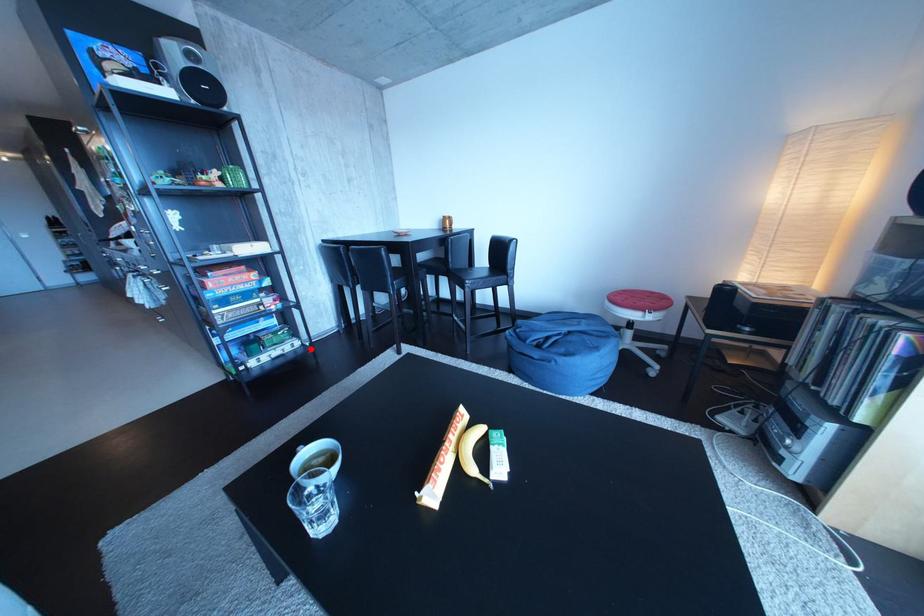
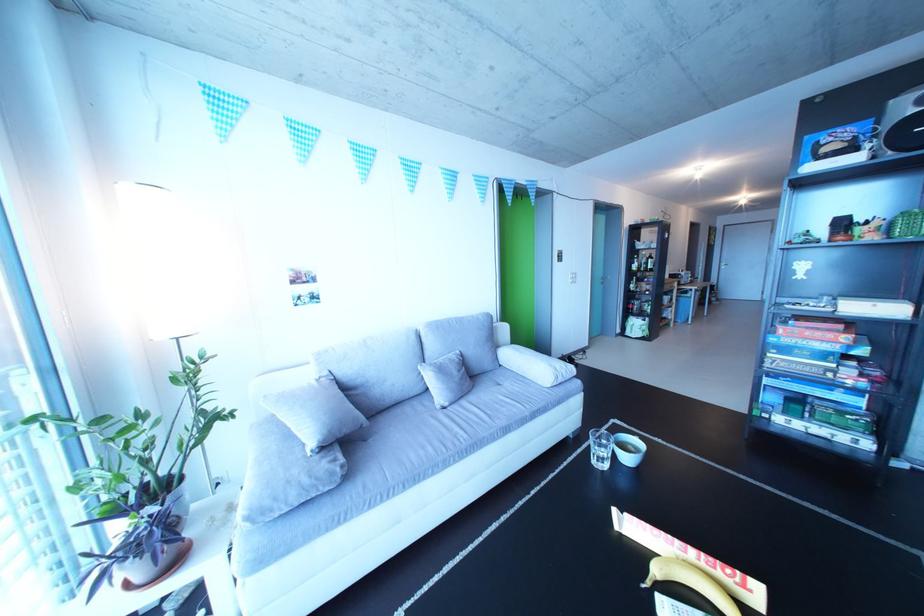
Question: I am providing you with two images of the same scene from different viewpoints. A red point is marked on the first image. Can you still see the location of the red point in image 2?

Choices:
 (A) Yes
 (B) No

Answer: (A)